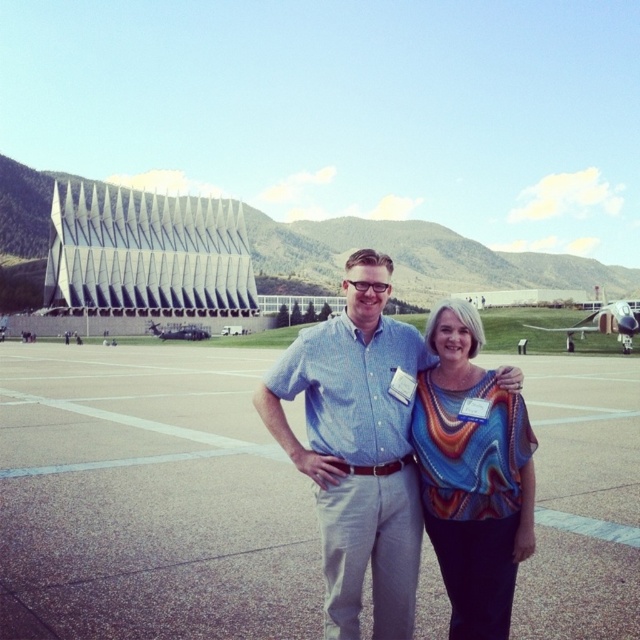
You are a photographer trying to capture a clear shot of the multicolored woven blouse at center and the concrete tarmac at center. However, you notice that the building in the background might obstruct your view. Can you still see both objects clearly without any obstruction?

The multicolored woven blouse at center is behind the concrete tarmac at center, so the concrete tarmac at center may block the view of the blouse. Therefore, you might not be able to see both clearly at the same time.

You are a photographer trying to capture a photo of the blue cotton shirt at center and the concrete tarmac at center. Which object should you focus on first if you want to ensure both are in sharp focus, considering their heights?

The concrete tarmac at center has a lesser height compared to blue cotton shirt at center, so you should focus on the blue cotton shirt at center first to ensure both are in sharp focus.